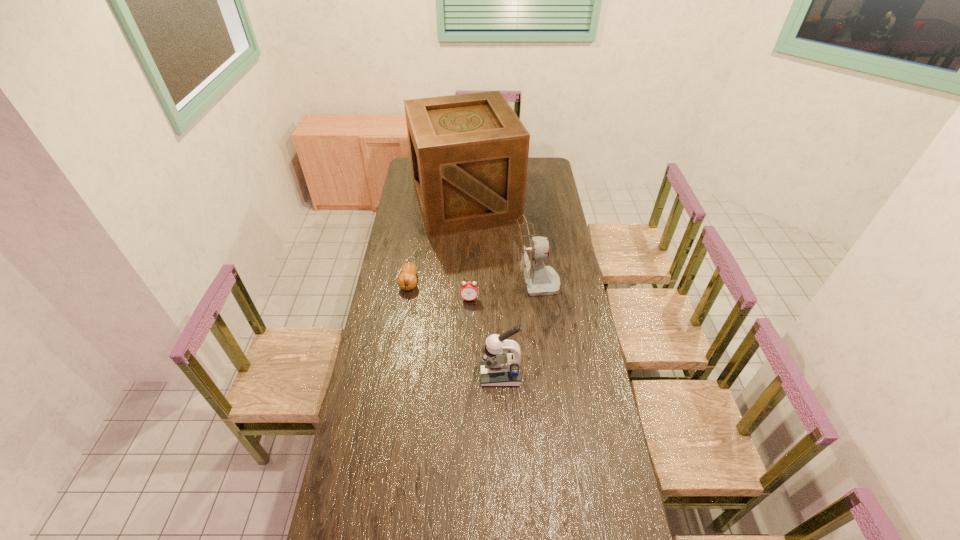
I want to click on the farthest object, so click(x=469, y=152).

In order to click on box in this screenshot , I will do coord(469,152).

Locate an element on the screen. fan is located at coordinates (529, 251).

What are the coordinates of `microscope` in the screenshot? It's located at (498, 368).

I want to click on the third tallest object, so click(498, 368).

Locate an element on the screen. alarm clock is located at coordinates (469, 291).

You are a GUI agent. You are given a task and a screenshot of the screen. Output one action in this format:
    pyautogui.click(x=<x>, y=<y>)
    Task: Click on the gourd
    The height and width of the screenshot is (540, 960).
    Given the screenshot: What is the action you would take?
    pyautogui.click(x=407, y=280)

The height and width of the screenshot is (540, 960). Identify the location of free space located 0.250m on the front of the box. (463, 272).

Locate an element on the screen. The width and height of the screenshot is (960, 540). free space located 0.180m in front of the second tallest object to blow air is located at coordinates (473, 284).

Identify the location of free point located 0.400m in front of the second tallest object to blow air. The width and height of the screenshot is (960, 540). (426, 284).